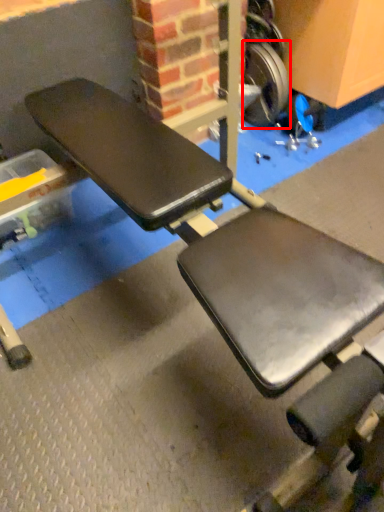
Question: Considering the relative positions of wheel (annotated by the red box) and wheel in the image provided, where is wheel (annotated by the red box) located with respect to the staircase?

Choices:
 (A) left
 (B) right

Answer: (B)